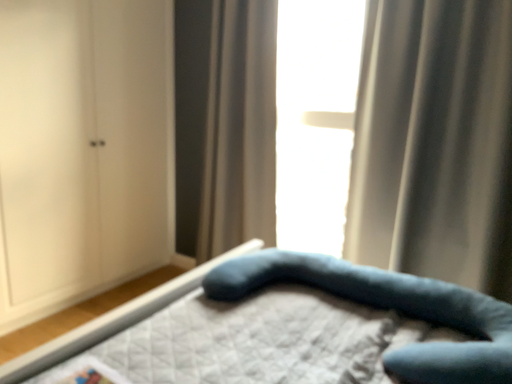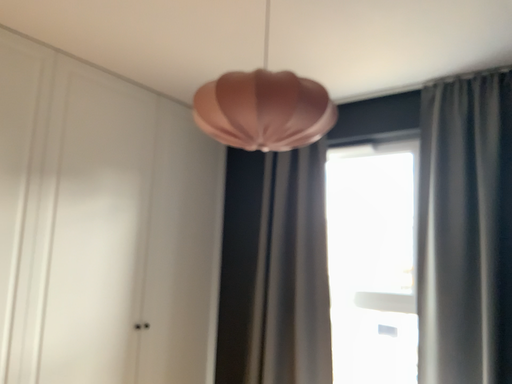
Question: Which way did the camera rotate in the video?

Choices:
 (A) rotated downward
 (B) rotated upward

Answer: (B)